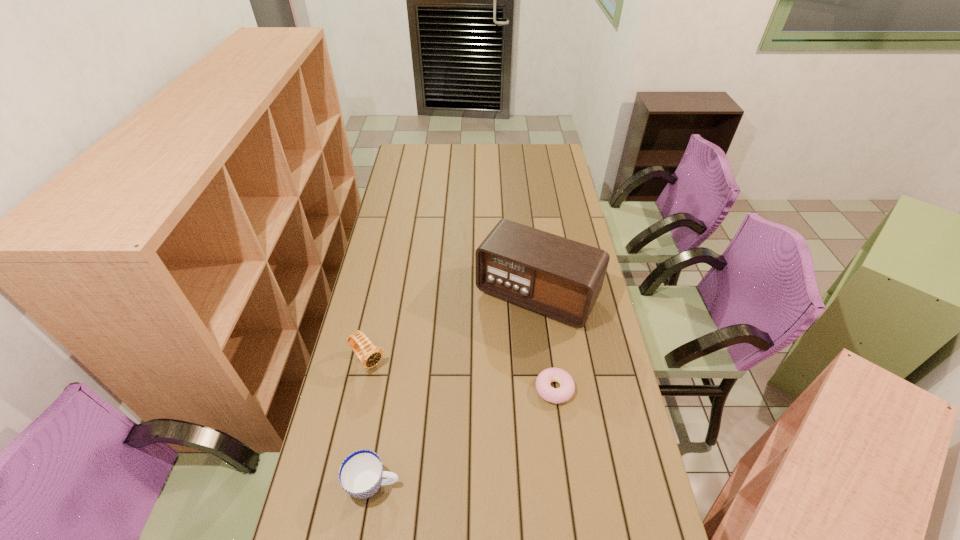
The image size is (960, 540). In the image, there is a desktop. Find the location of `vacant region at the far edge`. vacant region at the far edge is located at coordinates (498, 153).

I want to click on free point at the left edge, so click(x=372, y=407).

In the image, there is a desktop. Identify the location of free space at the right edge. This screenshot has width=960, height=540. (565, 187).

In the image, there is a desktop. Identify the location of vacant space at the far left corner. The width and height of the screenshot is (960, 540). (423, 145).

Find the location of a particular element. blank space at the far right corner of the desktop is located at coordinates (561, 163).

Find the location of `vacant space in between the cup and the watch`. vacant space in between the cup and the watch is located at coordinates (371, 422).

Image resolution: width=960 pixels, height=540 pixels. In order to click on free point between the watch and the doughnut in this screenshot , I will do `click(461, 375)`.

Where is `free spot between the shortest object and the cup`? free spot between the shortest object and the cup is located at coordinates (464, 436).

Image resolution: width=960 pixels, height=540 pixels. Find the location of `free space between the radio receiver and the watch`. free space between the radio receiver and the watch is located at coordinates (452, 328).

Find the location of a particular element. This screenshot has height=540, width=960. unoccupied area between the tallest object and the shortest object is located at coordinates (545, 342).